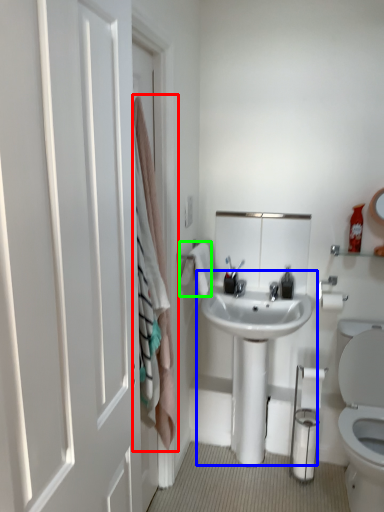
Question: Which is farther away from curtain (highlighted by a red box)? sink (highlighted by a blue box) or bath towel (highlighted by a green box)?

Choices:
 (A) sink
 (B) bath towel

Answer: (A)